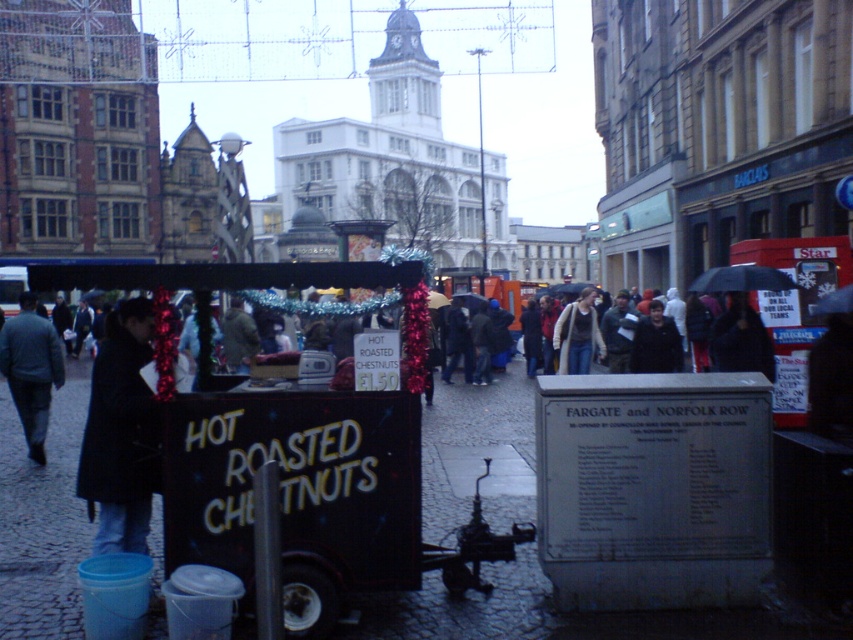
Question: Among these objects, which one is nearest to the camera?

Choices:
 (A) denim jacket at center
 (B) dark gray jacket at left

Answer: (B)

Question: Is dark gray jacket at left positioned in front of denim jacket at center?

Choices:
 (A) no
 (B) yes

Answer: (B)

Question: Does dark gray jacket at left have a greater width compared to denim jacket at center?

Choices:
 (A) yes
 (B) no

Answer: (A)

Question: Which of the following is the closest to the observer?

Choices:
 (A) dark gray jacket at left
 (B) denim jacket at center

Answer: (A)

Question: Does dark gray jacket at left appear on the right side of denim jacket at center?

Choices:
 (A) yes
 (B) no

Answer: (B)